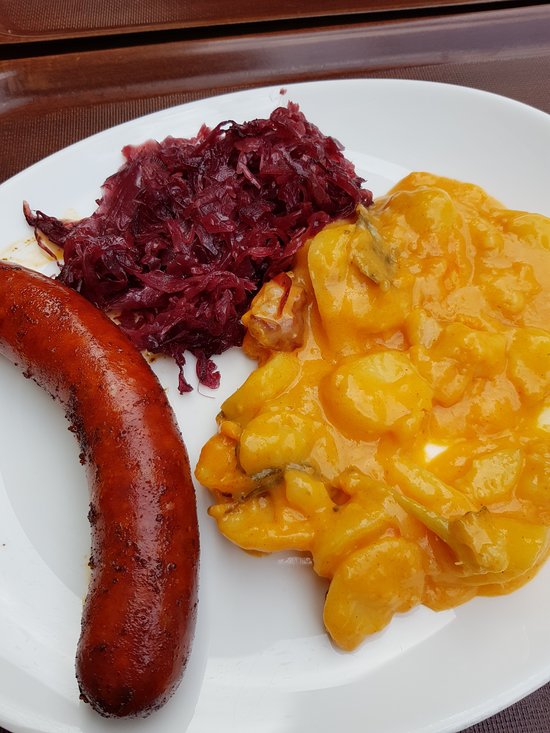
Locate an element on the screen. plate is located at coordinates (279, 608).